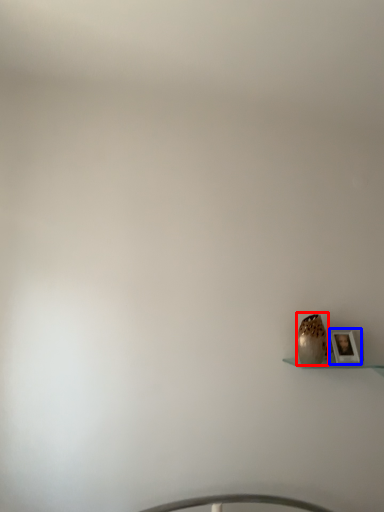
Question: Which object appears closest to the camera in this image, vase (highlighted by a red box) or picture frame (highlighted by a blue box)?

Choices:
 (A) vase
 (B) picture frame

Answer: (A)